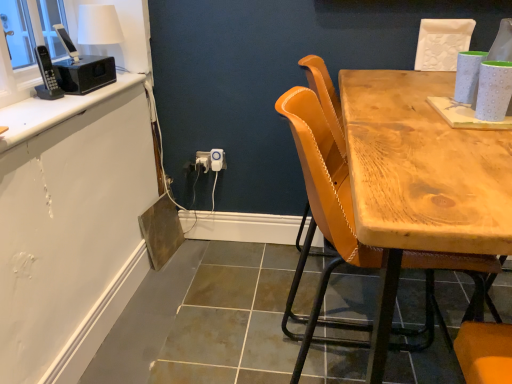
Question: Considering the relative sizes of white glossy countertop at upper left and white plastic power outlet at lower center, marked as the 1th power outlet in a left-to-right arrangement, in the image provided, is white glossy countertop at upper left shorter than white plastic power outlet at lower center, marked as the 1th power outlet in a left-to-right arrangement,?

Choices:
 (A) yes
 (B) no

Answer: (A)

Question: Considering the relative sizes of white glossy countertop at upper left and white plastic power outlet at lower center, marked as the 1th power outlet in a left-to-right arrangement, in the image provided, is white glossy countertop at upper left thinner than white plastic power outlet at lower center, marked as the 1th power outlet in a left-to-right arrangement,?

Choices:
 (A) yes
 (B) no

Answer: (B)

Question: From the image's perspective, is white glossy countertop at upper left beneath white plastic power outlet at lower center, marked as the 1th power outlet in a left-to-right arrangement?

Choices:
 (A) no
 (B) yes

Answer: (A)

Question: Is white glossy countertop at upper left located outside white plastic power outlet at lower center, marked as the 1th power outlet in a left-to-right arrangement?

Choices:
 (A) no
 (B) yes

Answer: (B)

Question: Considering the relative sizes of white glossy countertop at upper left and white plastic power outlet at lower center, placed as the 2th power outlet when sorted from right to left, in the image provided, is white glossy countertop at upper left wider than white plastic power outlet at lower center, placed as the 2th power outlet when sorted from right to left,?

Choices:
 (A) no
 (B) yes

Answer: (B)

Question: Looking at their shapes, would you say white plastic power outlet at center, positioned as the 2th power outlet in left-to-right order, is wider or thinner than leather-like yellow chair at center?

Choices:
 (A) thin
 (B) wide

Answer: (A)

Question: Is white plastic power outlet at center, positioned as the 2th power outlet in left-to-right order, situated inside leather-like yellow chair at center or outside?

Choices:
 (A) inside
 (B) outside

Answer: (B)

Question: In the image, is white plastic power outlet at center, positioned as the 2th power outlet in left-to-right order, positioned in front of or behind leather-like yellow chair at center?

Choices:
 (A) behind
 (B) front

Answer: (A)

Question: From a real-world perspective, relative to leather-like yellow chair at center, is white plastic power outlet at center, which is the first power outlet in right-to-left order, vertically above or below?

Choices:
 (A) above
 (B) below

Answer: (B)

Question: In terms of width, does white plastic electric outlet at center look wider or thinner when compared to white glossy countertop at upper left?

Choices:
 (A) wide
 (B) thin

Answer: (B)

Question: From the image's perspective, relative to white glossy countertop at upper left, is white plastic electric outlet at center above or below?

Choices:
 (A) above
 (B) below

Answer: (B)

Question: Considering the positions of point (222, 148) and point (91, 99), is point (222, 148) closer or farther from the camera than point (91, 99)?

Choices:
 (A) closer
 (B) farther

Answer: (B)

Question: Is white plastic electric outlet at center situated inside white glossy countertop at upper left or outside?

Choices:
 (A) outside
 (B) inside

Answer: (A)

Question: In terms of width, does white plastic electric outlet at center look wider or thinner when compared to leather-like yellow chair at center?

Choices:
 (A) wide
 (B) thin

Answer: (B)

Question: From the image's perspective, is white plastic electric outlet at center located above or below leather-like yellow chair at center?

Choices:
 (A) above
 (B) below

Answer: (A)